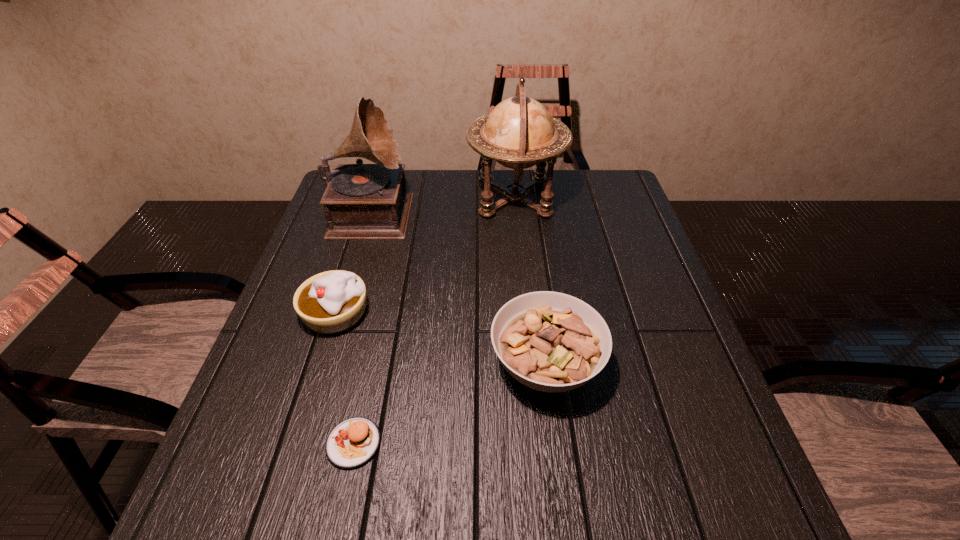
Identify the location of free space between the stew and the whipped cream. This screenshot has height=540, width=960. (441, 339).

In order to click on vacant point located between the record player and the whipped cream in this screenshot , I will do `click(354, 262)`.

The height and width of the screenshot is (540, 960). I want to click on vacant region between the whipped cream and the patty, so click(345, 378).

At what (x,y) coordinates should I click in order to perform the action: click on the second closest object to the globe. Please return your answer as a coordinate pair (x, y). Looking at the image, I should click on (333, 301).

Select which object appears as the closest to the globe. Please provide its 2D coordinates. Your answer should be formatted as a tuple, i.e. [(x, y)], where the tuple contains the x and y coordinates of a point satisfying the conditions above.

[(362, 201)]

Identify the location of free space in the image that satisfies the following two spatial constraints: 1. from the horn of the record player; 2. on the front side of the whipped cream. (341, 313).

You are a GUI agent. You are given a task and a screenshot of the screen. Output one action in this format:
    pyautogui.click(x=<x>, y=<y>)
    Task: Click on the free space that satisfies the following two spatial constraints: 1. from the horn of the record player; 2. on the back side of the patty
    The image size is (960, 540).
    Given the screenshot: What is the action you would take?
    pyautogui.click(x=301, y=443)

You are a GUI agent. You are given a task and a screenshot of the screen. Output one action in this format:
    pyautogui.click(x=<x>, y=<y>)
    Task: Click on the vacant point that satisfies the following two spatial constraints: 1. from the horn of the record player; 2. on the back side of the shortest object
    This screenshot has width=960, height=540.
    Given the screenshot: What is the action you would take?
    pyautogui.click(x=301, y=443)

Where is `vacant region that satisfies the following two spatial constraints: 1. on the back side of the nearest object; 2. from the horn of the record player`? vacant region that satisfies the following two spatial constraints: 1. on the back side of the nearest object; 2. from the horn of the record player is located at coordinates (403, 210).

You are a GUI agent. You are given a task and a screenshot of the screen. Output one action in this format:
    pyautogui.click(x=<x>, y=<y>)
    Task: Click on the free space that satisfies the following two spatial constraints: 1. on the front-facing side of the globe; 2. on the front side of the whipped cream
    Image resolution: width=960 pixels, height=540 pixels.
    Given the screenshot: What is the action you would take?
    pyautogui.click(x=526, y=313)